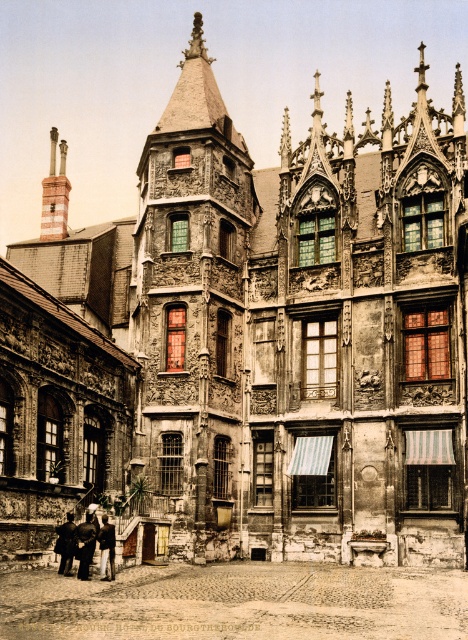
Question: Which object is positioned farthest from the dark brown leather jacket at lower left?

Choices:
 (A) dark wool coat at lower left
 (B) dark brown leather coat at lower left

Answer: (A)

Question: Among these objects, which one is farthest from the camera?

Choices:
 (A) dark brown leather coat at lower left
 (B) dark brown leather jacket at lower left

Answer: (B)

Question: Considering the relative positions of dark wool coat at lower left and dark brown leather jacket at lower left in the image provided, where is dark wool coat at lower left located with respect to dark brown leather jacket at lower left?

Choices:
 (A) below
 (B) above

Answer: (A)

Question: Which point is closer to the camera?

Choices:
 (A) dark wool coat at lower left
 (B) dark brown leather coat at lower left

Answer: (B)

Question: Is dark wool coat at lower left closer to camera compared to dark brown leather coat at lower left?

Choices:
 (A) no
 (B) yes

Answer: (A)

Question: Does dark wool coat at lower left have a greater width compared to dark brown leather jacket at lower left?

Choices:
 (A) no
 (B) yes

Answer: (B)